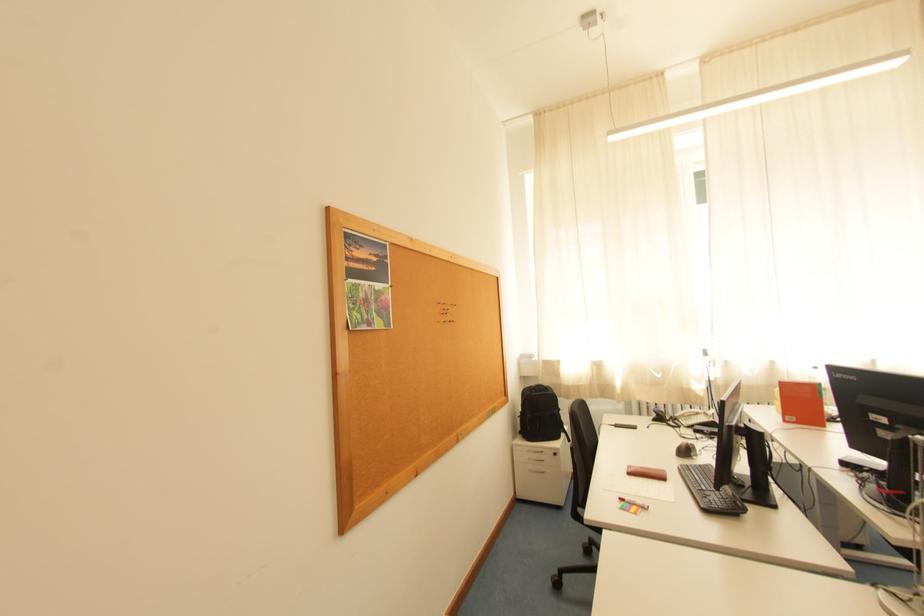
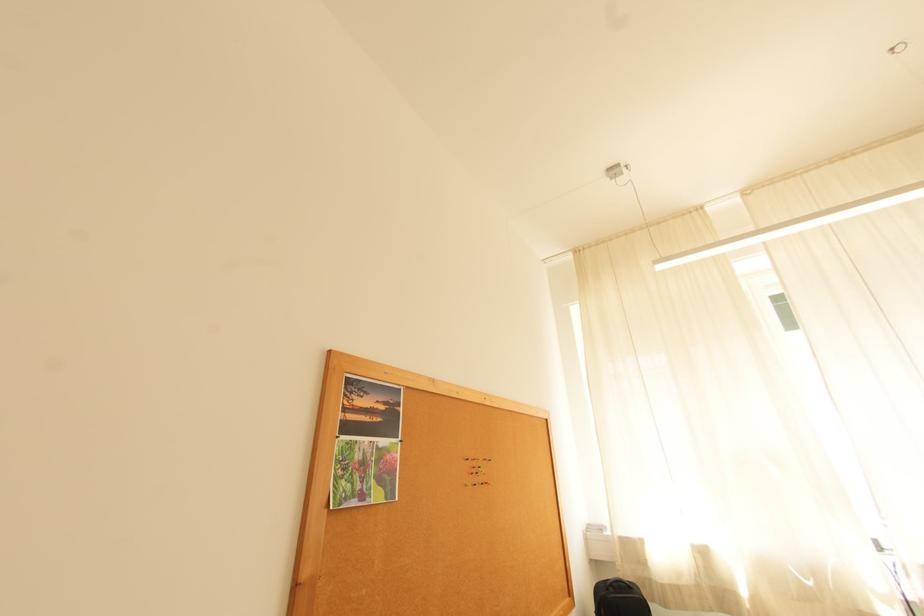
In a continuous first-person perspective shot, in which direction is the camera moving?

The cameraman walked toward right, forward.